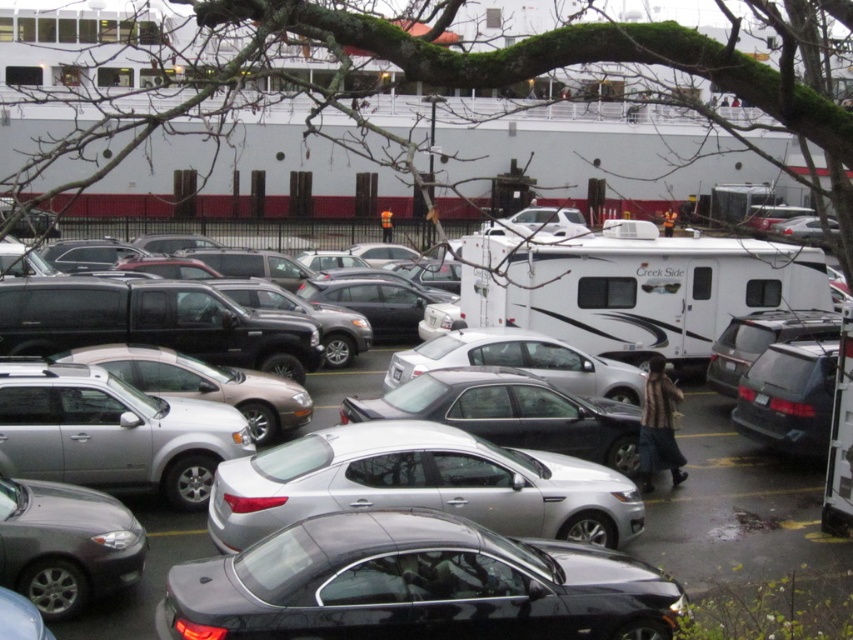
You are standing at the entrance of the parking lot and want to locate the glossy black sedan at center. According to the coordinates provided, where should you look relative to the parking lot entrance?

The glossy black sedan at center is located at point coordinates (416, 586), so it is positioned near the far end of the parking lot, opposite the entrance.